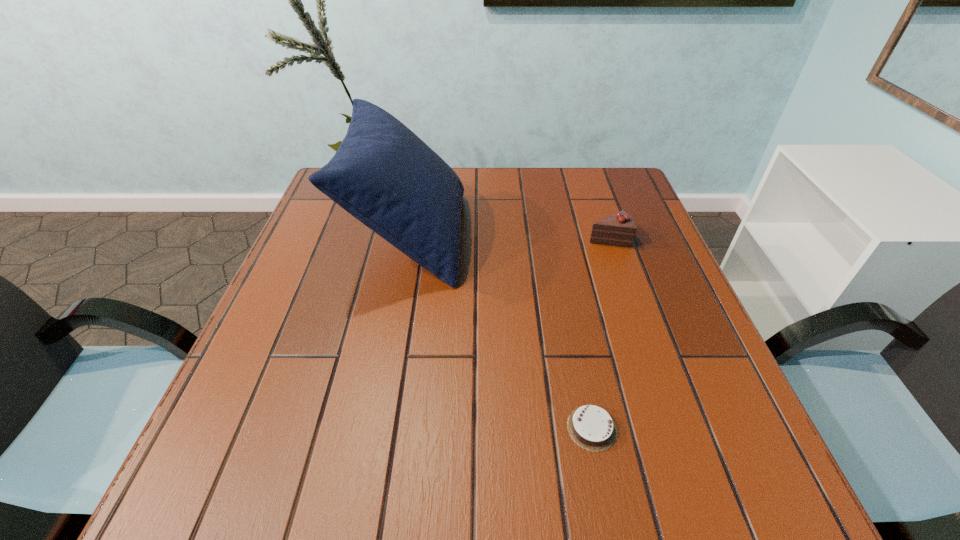
The width and height of the screenshot is (960, 540). In order to click on object that is at the near edge in this screenshot , I will do `click(591, 427)`.

Locate an element on the screen. The height and width of the screenshot is (540, 960). object that is at the left edge is located at coordinates (383, 174).

Image resolution: width=960 pixels, height=540 pixels. I want to click on object present at the right edge, so click(619, 229).

The image size is (960, 540). Find the location of `object that is at the far left corner`. object that is at the far left corner is located at coordinates (383, 174).

You are a GUI agent. You are given a task and a screenshot of the screen. Output one action in this format:
    pyautogui.click(x=<x>, y=<y>)
    Task: Click on the free space at the far edge of the desktop
    The height and width of the screenshot is (540, 960).
    Given the screenshot: What is the action you would take?
    pyautogui.click(x=530, y=184)

This screenshot has height=540, width=960. I want to click on free space at the near edge of the desktop, so click(468, 471).

The height and width of the screenshot is (540, 960). I want to click on vacant space at the left edge of the desktop, so click(290, 393).

Find the location of a particular element. free space at the right edge of the desktop is located at coordinates (657, 254).

I want to click on vacant space at the far right corner of the desktop, so click(x=639, y=198).

The height and width of the screenshot is (540, 960). In order to click on vacant point located between the leftmost object and the second object from left to right in this screenshot , I will do `click(501, 332)`.